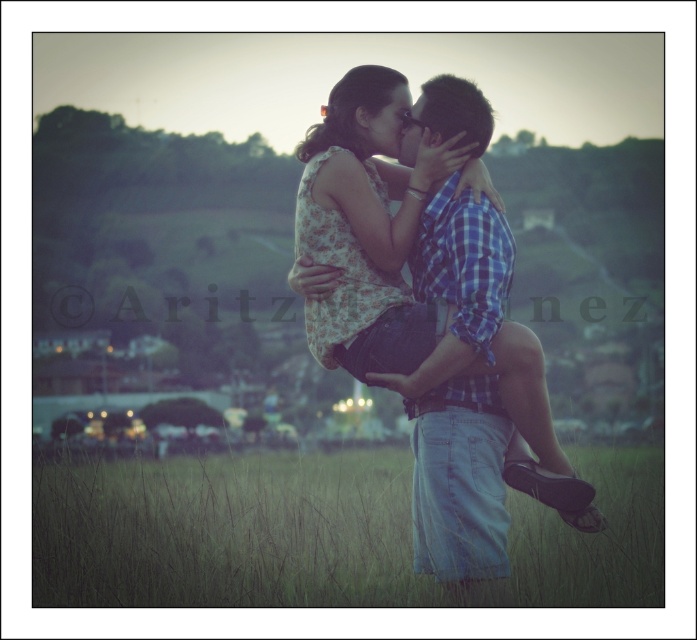
Question: Is green grass at lower center to the right of floral fabric dress at center from the viewer's perspective?

Choices:
 (A) yes
 (B) no

Answer: (B)

Question: Which object is closer to the camera taking this photo?

Choices:
 (A) floral fabric dress at center
 (B) blue plaid shirt at center
 (C) green grass at lower center

Answer: (C)

Question: Which object is positioned closest to the floral fabric dress at center?

Choices:
 (A) blue plaid shirt at center
 (B) green grass at lower center

Answer: (A)

Question: Does green grass at lower center appear over blue plaid shirt at center?

Choices:
 (A) no
 (B) yes

Answer: (A)

Question: Does green grass at lower center have a greater width compared to floral fabric dress at center?

Choices:
 (A) no
 (B) yes

Answer: (B)

Question: Which point is closer to the camera?

Choices:
 (A) (100, 557)
 (B) (450, 164)

Answer: (B)